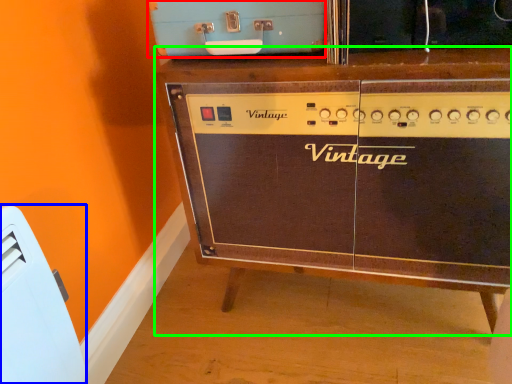
Question: Which object is positioned farthest from appliance (highlighted by a red box)? Select from appliance (highlighted by a blue box) and furniture (highlighted by a green box).

Choices:
 (A) appliance
 (B) furniture

Answer: (A)